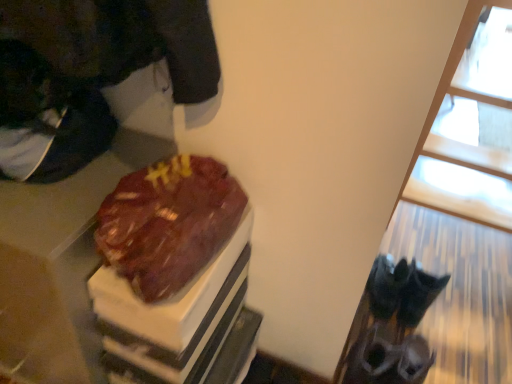
In order to face transparent glass window at upper right, should I rotate leftwards or rightwards?

Turn right by 30.683 degrees to look at transparent glass window at upper right.

At what (x,y) coordinates should I click in order to perform the action: click on transparent glass window at upper right. Please return your answer as a coordinate pair (x, y). The height and width of the screenshot is (384, 512). Looking at the image, I should click on (365, 338).

Measure the distance between transparent glass window at upper right and camera.

transparent glass window at upper right is 3.91 feet from camera.

The image size is (512, 384). What do you see at coordinates (365, 338) in the screenshot?
I see `transparent glass window at upper right` at bounding box center [365, 338].

Measure the distance between shiny chocolate cake at center and camera.

shiny chocolate cake at center is 28.50 inches away from camera.

Where is `shiny chocolate cake at center`? shiny chocolate cake at center is located at coordinates (168, 223).

Measure the distance between point (163, 243) and camera.

Point (163, 243) is 29.61 inches away from camera.

What do you see at coordinates (168, 223) in the screenshot? I see `shiny chocolate cake at center` at bounding box center [168, 223].

Find the location of `transparent glass window at upper right`. transparent glass window at upper right is located at coordinates (365, 338).

Considering the relative positions of transparent glass window at upper right and shiny chocolate cake at center in the image provided, is transparent glass window at upper right to the left of shiny chocolate cake at center from the viewer's perspective?

In fact, transparent glass window at upper right is to the right of shiny chocolate cake at center.

Does transparent glass window at upper right lie behind shiny chocolate cake at center?

No, it is not.

Which is less distant, [425,137] or [145,189]?

Positioned in front is point [145,189].

From the image's perspective, would you say transparent glass window at upper right is positioned over shiny chocolate cake at center?

Indeed, from the image's perspective, transparent glass window at upper right is shown above shiny chocolate cake at center.

From a real-world perspective, does transparent glass window at upper right sit lower than shiny chocolate cake at center?

Correct, in the physical world, transparent glass window at upper right is lower than shiny chocolate cake at center.

Which object is wider, transparent glass window at upper right or shiny chocolate cake at center?

Wider between the two is transparent glass window at upper right.

Considering the relative sizes of transparent glass window at upper right and shiny chocolate cake at center in the image provided, is transparent glass window at upper right shorter than shiny chocolate cake at center?

No, transparent glass window at upper right is not shorter than shiny chocolate cake at center.

Consider the image. Does transparent glass window at upper right have a larger size compared to shiny chocolate cake at center?

Correct, transparent glass window at upper right is larger in size than shiny chocolate cake at center.

Is transparent glass window at upper right completely or partially outside of shiny chocolate cake at center?

Yes, transparent glass window at upper right is outside of shiny chocolate cake at center.

Is transparent glass window at upper right directly adjacent to shiny chocolate cake at center?

No, transparent glass window at upper right is not beside shiny chocolate cake at center.

Is transparent glass window at upper right oriented away from shiny chocolate cake at center?

transparent glass window at upper right is not turned away from shiny chocolate cake at center.

How distant is transparent glass window at upper right from shiny chocolate cake at center?

They are 27.49 inches apart.

The image size is (512, 384). Find the location of `chocolate cake on the left of transparent glass window at upper right`. chocolate cake on the left of transparent glass window at upper right is located at coordinates (168, 223).

Considering the relative positions of shiny chocolate cake at center and transparent glass window at upper right in the image provided, is shiny chocolate cake at center to the right of transparent glass window at upper right from the viewer's perspective?

No, shiny chocolate cake at center is not to the right of transparent glass window at upper right.

From the picture: Between shiny chocolate cake at center and transparent glass window at upper right, which one is positioned in front?

transparent glass window at upper right.

Considering the positions of points (116, 199) and (455, 57), is point (116, 199) farther from camera compared to point (455, 57)?

No.

From the image's perspective, would you say shiny chocolate cake at center is shown under transparent glass window at upper right?

Correct, shiny chocolate cake at center appears lower than transparent glass window at upper right in the image.

From a real-world perspective, does shiny chocolate cake at center stand above transparent glass window at upper right?

Yes, from a real-world perspective, shiny chocolate cake at center is above transparent glass window at upper right.

Which object is thinner, shiny chocolate cake at center or transparent glass window at upper right?

shiny chocolate cake at center.

Does shiny chocolate cake at center have a greater height compared to transparent glass window at upper right?

Incorrect, the height of shiny chocolate cake at center is not larger of that of transparent glass window at upper right.

In terms of size, does shiny chocolate cake at center appear bigger or smaller than transparent glass window at upper right?

In the image, shiny chocolate cake at center appears to be smaller than transparent glass window at upper right.

Is transparent glass window at upper right inside shiny chocolate cake at center?

No, transparent glass window at upper right is not a part of shiny chocolate cake at center.

Is shiny chocolate cake at center beside transparent glass window at upper right?

No, shiny chocolate cake at center is not making contact with transparent glass window at upper right.

Is shiny chocolate cake at center oriented towards transparent glass window at upper right?

No, shiny chocolate cake at center is not oriented towards transparent glass window at upper right.

At what (x,y) coordinates should I click in order to perform the action: click on chocolate cake behind the transparent glass window at upper right. Please return your answer as a coordinate pair (x, y). Image resolution: width=512 pixels, height=384 pixels. Looking at the image, I should click on (168, 223).

This screenshot has height=384, width=512. I want to click on window beneath the shiny chocolate cake at center (from a real-world perspective), so click(x=365, y=338).

Locate an element on the screen. chocolate cake that is behind the transparent glass window at upper right is located at coordinates (168, 223).